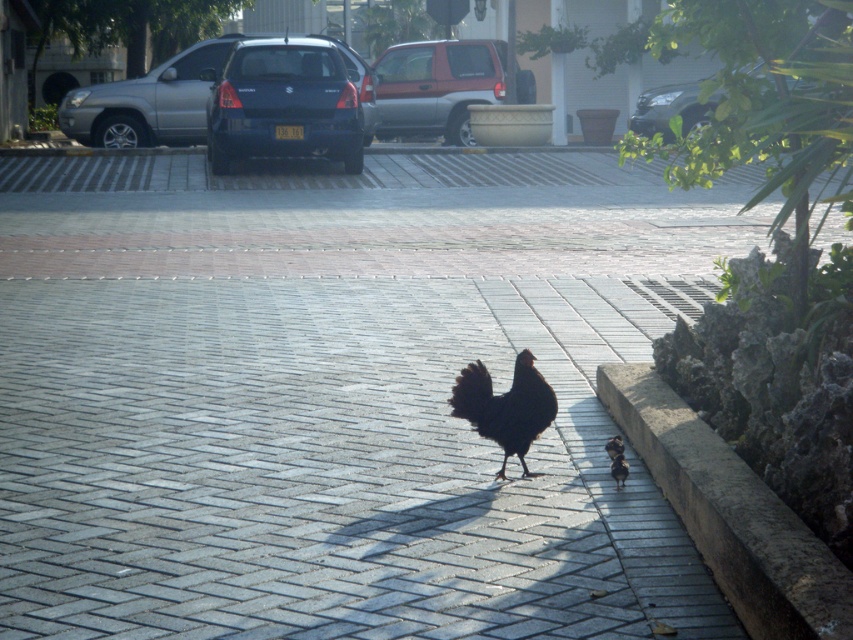
Measure the distance between matte blue hatchback at center and camera.

matte blue hatchback at center is 21.03 meters away from camera.

Is the position of matte blue hatchback at center less distant than that of black feathered chicken at lower right?

No.

Where is `matte blue hatchback at center`? The image size is (853, 640). matte blue hatchback at center is located at coordinates (283, 104).

This screenshot has height=640, width=853. Identify the location of matte blue hatchback at center. (283, 104).

From the picture: Can you confirm if matte blue hatchback at center is bigger than metallic silver suv at upper center?

No, matte blue hatchback at center is not bigger than metallic silver suv at upper center.

Locate an element on the screen. The height and width of the screenshot is (640, 853). matte blue hatchback at center is located at coordinates click(283, 104).

Image resolution: width=853 pixels, height=640 pixels. Describe the element at coordinates (283, 104) in the screenshot. I see `matte blue hatchback at center` at that location.

At what (x,y) coordinates should I click in order to perform the action: click on matte blue hatchback at center. Please return your answer as a coordinate pair (x, y). The image size is (853, 640). Looking at the image, I should click on (283, 104).

Based on the photo, which of these two, matte black car at center or metallic silver suv at upper center, stands shorter?

With less height is matte black car at center.

Find the location of a particular element. matte black car at center is located at coordinates pos(149,100).

You are a GUI agent. You are given a task and a screenshot of the screen. Output one action in this format:
    pyautogui.click(x=<x>, y=<y>)
    Task: Click on the matte black car at center
    The height and width of the screenshot is (640, 853).
    Given the screenshot: What is the action you would take?
    pyautogui.click(x=149, y=100)